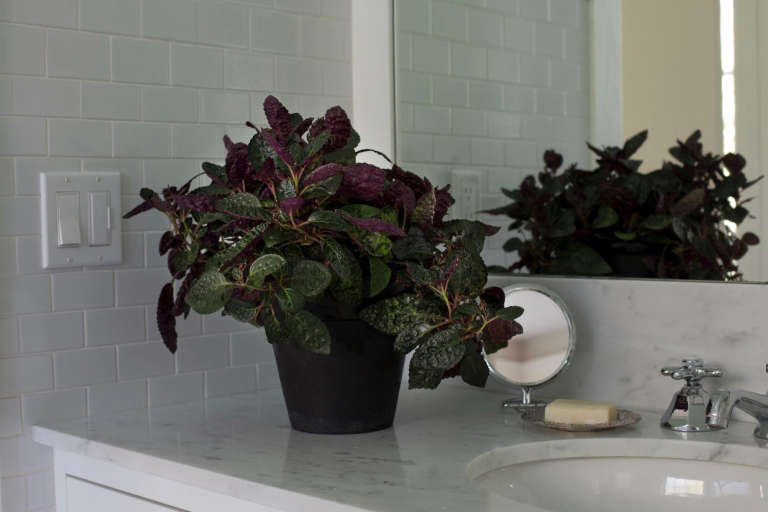
This screenshot has height=512, width=768. Identify the location of marble surface. (372, 473).